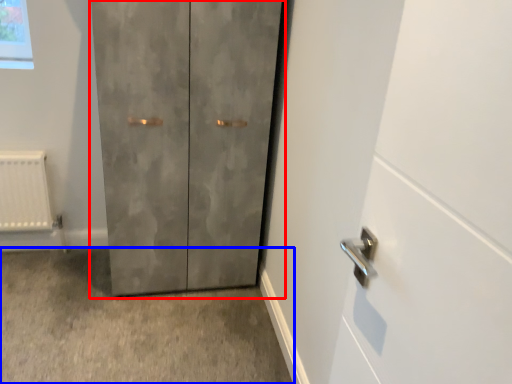
Question: Which object appears closest to the camera in this image, door (highlighted by a red box) or concrete (highlighted by a blue box)?

Choices:
 (A) door
 (B) concrete

Answer: (B)